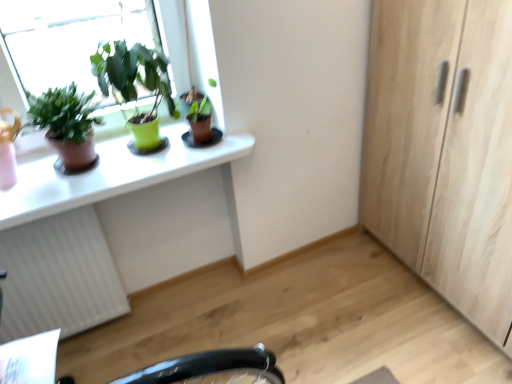
The height and width of the screenshot is (384, 512). I want to click on vacant space behind white glossy computer desk at upper left, so click(222, 326).